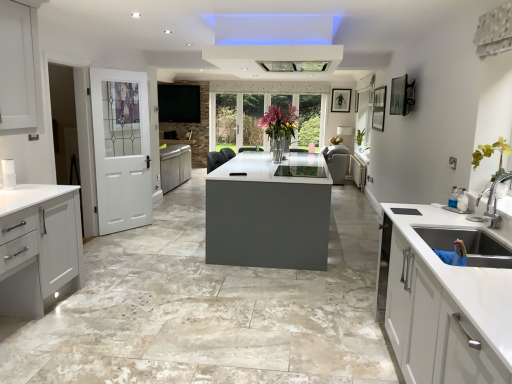
Locate an element on the screen. This screenshot has width=512, height=384. vacant area that lies to the right of white painted wood door at left is located at coordinates (154, 233).